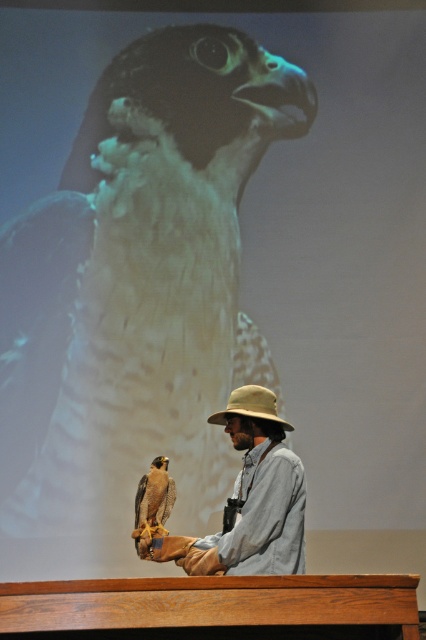
Does point (126, 365) lie in front of point (143, 529)?

That is False.

Who is more distant from viewer, (106, 538) or (150, 524)?

The point (106, 538) is more distant.

Is point (120, 244) positioned after point (143, 484)?

Yes, point (120, 244) is behind point (143, 484).

At what (x,y) coordinates should I click in order to perform the action: click on brown feathered falcon at center. Please return your answer as a coordinate pair (x, y). Looking at the image, I should click on (138, 285).

Between khaki fabric hat at center and brown feathered falcon at lower left, which one appears on the right side from the viewer's perspective?

khaki fabric hat at center is more to the right.

Is point (261, 564) less distant than point (166, 506)?

Yes, it is in front of point (166, 506).

The height and width of the screenshot is (640, 426). Find the location of `khaki fabric hat at center`. khaki fabric hat at center is located at coordinates (238, 500).

This screenshot has height=640, width=426. What are the coordinates of `khaki fabric hat at center` in the screenshot? It's located at (238, 500).

Who is more distant from viewer, (x=302, y=529) or (x=262, y=388)?

Positioned behind is point (x=262, y=388).

Between khaki fabric hat at center and tan fabric hat at center, which one appears on the left side from the viewer's perspective?

khaki fabric hat at center is more to the left.

Where is `khaki fabric hat at center`? khaki fabric hat at center is located at coordinates (238, 500).

In order to click on khaki fabric hat at center in this screenshot , I will do `click(238, 500)`.